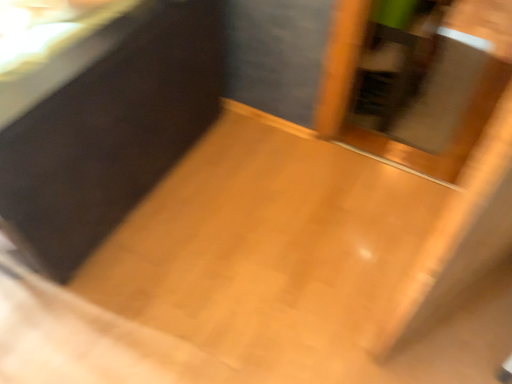
Question: From the image's perspective, is transparent glass screen door at center positioned above or below matte black vanity at upper left?

Choices:
 (A) above
 (B) below

Answer: (A)

Question: Is transparent glass screen door at center taller or shorter than matte black vanity at upper left?

Choices:
 (A) tall
 (B) short

Answer: (B)

Question: Is transparent glass screen door at center wider or thinner than matte black vanity at upper left?

Choices:
 (A) wide
 (B) thin

Answer: (A)

Question: In the image, is matte black vanity at upper left positioned in front of or behind transparent glass screen door at center?

Choices:
 (A) front
 (B) behind

Answer: (A)

Question: From a real-world perspective, is matte black vanity at upper left positioned above or below transparent glass screen door at center?

Choices:
 (A) above
 (B) below

Answer: (A)

Question: Is point (76, 140) positioned closer to the camera than point (461, 153)?

Choices:
 (A) farther
 (B) closer

Answer: (B)

Question: In terms of width, does matte black vanity at upper left look wider or thinner when compared to transparent glass screen door at center?

Choices:
 (A) thin
 (B) wide

Answer: (A)